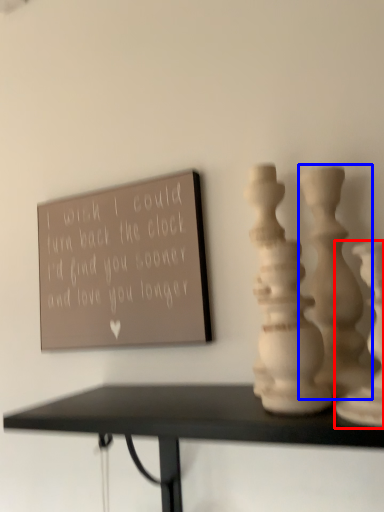
Question: Which object is closer to the camera taking this photo, vase (highlighted by a red box) or vase (highlighted by a blue box)?

Choices:
 (A) vase
 (B) vase

Answer: (A)